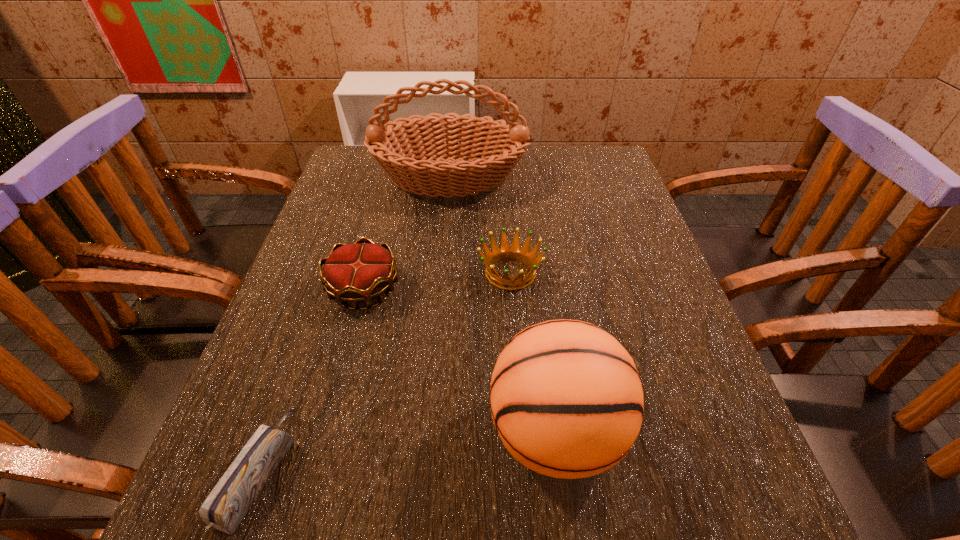
Locate an element on the screen. The width and height of the screenshot is (960, 540). free space between the left crown and the right crown is located at coordinates (437, 281).

Locate an element on the screen. The image size is (960, 540). free spot between the shortest object and the right crown is located at coordinates (384, 372).

Identify the location of free space between the second tallest object and the left crown. This screenshot has height=540, width=960. coord(460,361).

Locate an element on the screen. free space between the pencil box and the basket is located at coordinates (353, 325).

The height and width of the screenshot is (540, 960). I want to click on vacant area that lies between the shortest object and the second tallest object, so click(x=407, y=451).

Where is `the closest object to the right crown`? The height and width of the screenshot is (540, 960). the closest object to the right crown is located at coordinates (355, 273).

The height and width of the screenshot is (540, 960). I want to click on the closest object relative to the left crown, so click(x=514, y=252).

In order to click on blank space that satisfies the following two spatial constraints: 1. on the back side of the tallest object; 2. on the right side of the shortest object in this screenshot , I will do `click(363, 178)`.

At what (x,y) coordinates should I click in order to perform the action: click on vacant area that satisfies the following two spatial constraints: 1. on the back side of the left crown; 2. on the right side of the right crown. Please return your answer as a coordinate pair (x, y). Looking at the image, I should click on click(368, 273).